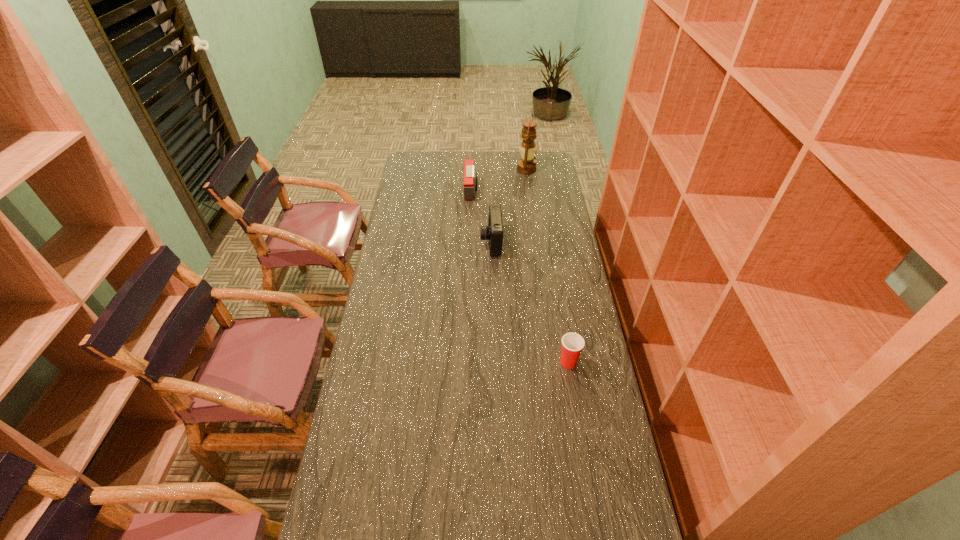
The width and height of the screenshot is (960, 540). I want to click on empty space that is in between the third object from right to left and the tallest object, so click(509, 206).

At what (x,y) coordinates should I click in order to perform the action: click on empty location between the Dixie cup and the tallest object. Please return your answer as a coordinate pair (x, y). The height and width of the screenshot is (540, 960). Looking at the image, I should click on (547, 266).

I want to click on empty location between the Dixie cup and the right camera, so click(x=530, y=302).

Locate an element on the screen. vacant space in between the tallest object and the Dixie cup is located at coordinates (547, 266).

Where is `vacant area between the Dixie cup and the farther camera`? The width and height of the screenshot is (960, 540). vacant area between the Dixie cup and the farther camera is located at coordinates (519, 277).

Image resolution: width=960 pixels, height=540 pixels. I want to click on free spot between the Dixie cup and the left camera, so click(519, 277).

Where is `empty space between the farthest object and the nearest object`? The image size is (960, 540). empty space between the farthest object and the nearest object is located at coordinates (547, 266).

Identify which object is the nearest to the right camera. Please provide its 2D coordinates. Your answer should be formatted as a tuple, i.e. [(x, y)], where the tuple contains the x and y coordinates of a point satisfying the conditions above.

[(470, 176)]

Choose which object is the third nearest neighbor to the leftmost object. Please provide its 2D coordinates. Your answer should be formatted as a tuple, i.e. [(x, y)], where the tuple contains the x and y coordinates of a point satisfying the conditions above.

[(572, 343)]

This screenshot has height=540, width=960. Identify the location of free spot that satisfies the following two spatial constraints: 1. on the front-facing side of the leftmost object; 2. on the back side of the Dixie cup. (468, 362).